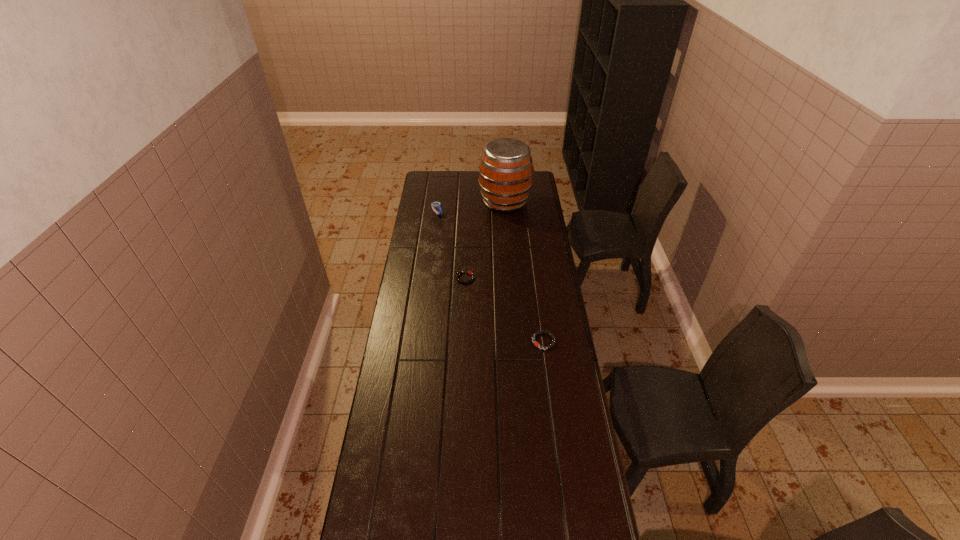
This screenshot has height=540, width=960. Identify the location of vacant area situated on the left of the farther bracelet. (435, 278).

At what (x,y) coordinates should I click in order to perform the action: click on object located in the far edge section of the desktop. Please return your answer as a coordinate pair (x, y). Looking at the image, I should click on (505, 172).

Locate an element on the screen. object at the left edge is located at coordinates (434, 204).

Image resolution: width=960 pixels, height=540 pixels. What are the coordinates of `cider at the right edge` in the screenshot? It's located at (505, 172).

You are a GUI agent. You are given a task and a screenshot of the screen. Output one action in this format:
    pyautogui.click(x=<x>, y=<y>)
    Task: Click on the bracelet that is positioned at the right edge
    
    Given the screenshot: What is the action you would take?
    coord(536,333)

Where is `object present at the far right corner`? The width and height of the screenshot is (960, 540). object present at the far right corner is located at coordinates (505, 172).

In the image, there is a desktop. Identify the location of vacant region at the left edge. (367, 485).

Image resolution: width=960 pixels, height=540 pixels. In order to click on vacant space at the right edge of the desktop in this screenshot , I will do `click(536, 197)`.

Locate an element on the screen. The height and width of the screenshot is (540, 960). vacant area that lies between the watch and the nearer bracelet is located at coordinates pos(491,277).

Find the location of a particular element. The image size is (960, 540). free space between the right bracelet and the watch is located at coordinates (x=491, y=277).